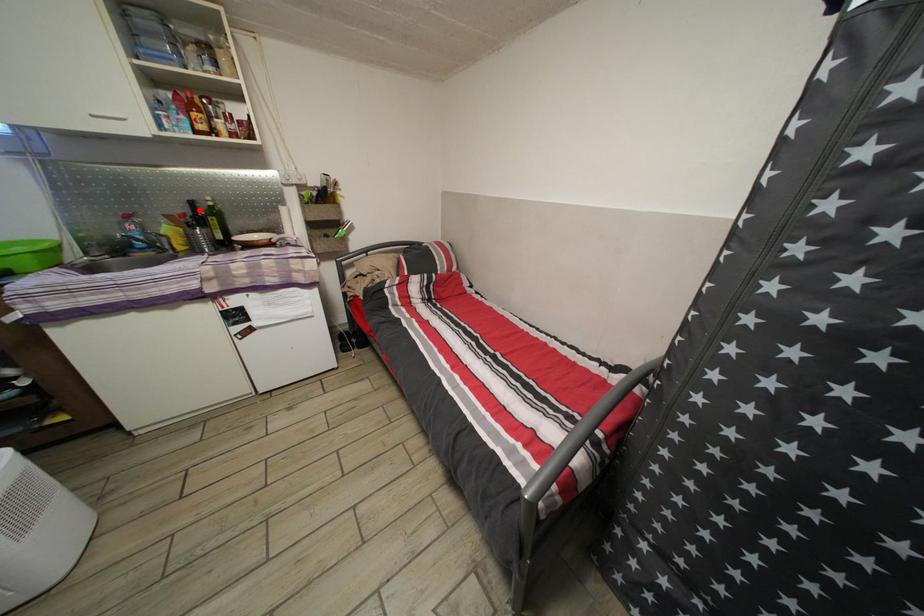
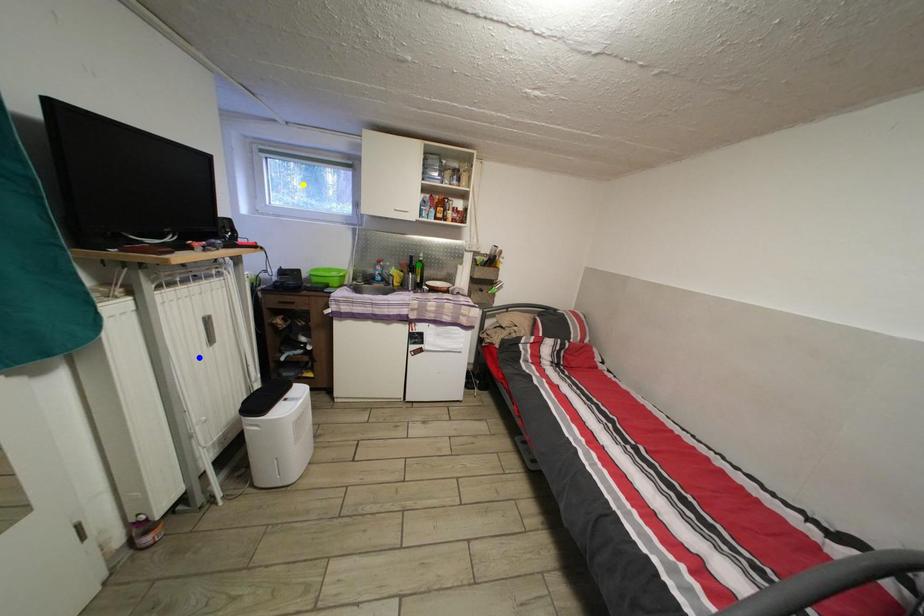
Question: I am providing you with two images of the same scene from different viewpoints. A red point is marked on the first image. You are given multiple points on the second image. Which point in image 2 represents the same 3d spot as the red point in image 1?

Choices:
 (A) yellow point
 (B) blue point
 (C) green point

Answer: (C)